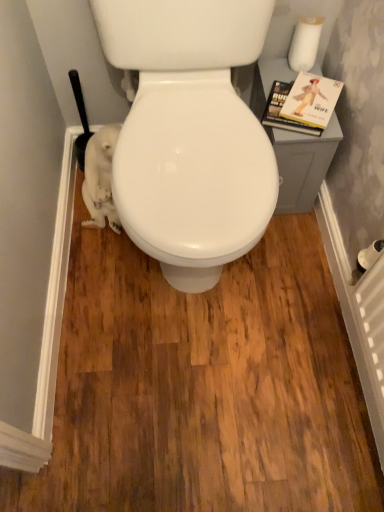
In order to face white matte toilet paper at upper right, should I rotate leftwards or rightwards?

Rotate your view right by about 15.030°.

You are a GUI agent. You are given a task and a screenshot of the screen. Output one action in this format:
    pyautogui.click(x=<x>, y=<y>)
    Task: Click on the white matte toilet paper at upper right
    The image size is (384, 512).
    Given the screenshot: What is the action you would take?
    pyautogui.click(x=305, y=42)

Describe the element at coordinates (305, 42) in the screenshot. I see `white matte toilet paper at upper right` at that location.

Measure the distance between white matte toilet paper at upper right and camera.

They are 1.08 meters apart.

Measure the distance between point (290, 127) and camera.

Point (290, 127) and camera are 1.07 meters apart.

What do you see at coordinates (302, 104) in the screenshot? I see `hardcover book at upper right` at bounding box center [302, 104].

Find the location of a particular element. The width and height of the screenshot is (384, 512). hardcover book at upper right is located at coordinates (302, 104).

Measure the distance between hardcover book at upper right and camera.

The depth of hardcover book at upper right is 1.06 meters.

Locate an element on the screen. This screenshot has height=512, width=384. white matte toilet paper at upper right is located at coordinates (305, 42).

Considering the positions of objects hardcover book at upper right and white matte toilet paper at upper right in the image provided, who is more to the right, hardcover book at upper right or white matte toilet paper at upper right?

Positioned to the right is white matte toilet paper at upper right.

Relative to white matte toilet paper at upper right, is hardcover book at upper right in front or behind?

hardcover book at upper right is in front of white matte toilet paper at upper right.

Which point is more forward, [288,101] or [295,28]?

Positioned in front is point [288,101].

From the image's perspective, which is above, hardcover book at upper right or white matte toilet paper at upper right?

white matte toilet paper at upper right.

From a real-world perspective, is hardcover book at upper right under white matte toilet paper at upper right?

Yes, from a real-world perspective, hardcover book at upper right is under white matte toilet paper at upper right.

Considering the relative sizes of hardcover book at upper right and white matte toilet paper at upper right in the image provided, is hardcover book at upper right thinner than white matte toilet paper at upper right?

No, hardcover book at upper right is not thinner than white matte toilet paper at upper right.

Considering the relative sizes of hardcover book at upper right and white matte toilet paper at upper right in the image provided, is hardcover book at upper right shorter than white matte toilet paper at upper right?

Correct, hardcover book at upper right is not as tall as white matte toilet paper at upper right.

Does hardcover book at upper right have a smaller size compared to white matte toilet paper at upper right?

Actually, hardcover book at upper right might be larger than white matte toilet paper at upper right.

Is hardcover book at upper right not inside white matte toilet paper at upper right?

hardcover book at upper right is positioned outside white matte toilet paper at upper right.

Are hardcover book at upper right and white matte toilet paper at upper right making contact?

No, hardcover book at upper right is not with white matte toilet paper at upper right.

Is hardcover book at upper right positioned with its back to white matte toilet paper at upper right?

No, hardcover book at upper right is not facing the opposite direction of white matte toilet paper at upper right.

Looking at this image, how far apart are hardcover book at upper right and white matte toilet paper at upper right?

hardcover book at upper right is 4.30 inches from white matte toilet paper at upper right.

This screenshot has height=512, width=384. I want to click on magazine that is below the white matte toilet paper at upper right (from the image's perspective), so click(302, 104).

Is white matte toilet paper at upper right at the left side of hardcover book at upper right?

Incorrect, white matte toilet paper at upper right is not on the left side of hardcover book at upper right.

Between white matte toilet paper at upper right and hardcover book at upper right, which one is positioned behind?

white matte toilet paper at upper right is more distant.

Is point (307, 21) positioned in front of point (265, 123)?

That is False.

From the image's perspective, would you say white matte toilet paper at upper right is shown under hardcover book at upper right?

No, from the image's perspective, white matte toilet paper at upper right is not below hardcover book at upper right.

From a real-world perspective, between white matte toilet paper at upper right and hardcover book at upper right, who is vertically lower?

In real-world perspective, hardcover book at upper right is lower.

Considering the relative sizes of white matte toilet paper at upper right and hardcover book at upper right in the image provided, is white matte toilet paper at upper right wider than hardcover book at upper right?

No, white matte toilet paper at upper right is not wider than hardcover book at upper right.

In terms of height, does white matte toilet paper at upper right look taller or shorter compared to hardcover book at upper right?

Clearly, white matte toilet paper at upper right is taller compared to hardcover book at upper right.

Considering the relative sizes of white matte toilet paper at upper right and hardcover book at upper right in the image provided, is white matte toilet paper at upper right smaller than hardcover book at upper right?

Yes, white matte toilet paper at upper right is smaller than hardcover book at upper right.

Is hardcover book at upper right located within white matte toilet paper at upper right?

No, hardcover book at upper right is not surrounded by white matte toilet paper at upper right.

Are white matte toilet paper at upper right and hardcover book at upper right far apart?

Actually, white matte toilet paper at upper right and hardcover book at upper right are a little close together.

Is white matte toilet paper at upper right aimed at hardcover book at upper right?

Yes.

How different are the orientations of white matte toilet paper at upper right and hardcover book at upper right in degrees?

They differ by 21.6 degrees in their facing directions.

Find the location of a particular element. The width and height of the screenshot is (384, 512). magazine lying on the left of white matte toilet paper at upper right is located at coordinates (302, 104).

Find the location of `toilet paper that appears above the hardcover book at upper right (from a real-world perspective)`. toilet paper that appears above the hardcover book at upper right (from a real-world perspective) is located at coordinates (305, 42).

Find the location of a particular element. This screenshot has height=512, width=384. toilet paper lying above the hardcover book at upper right (from the image's perspective) is located at coordinates (305, 42).